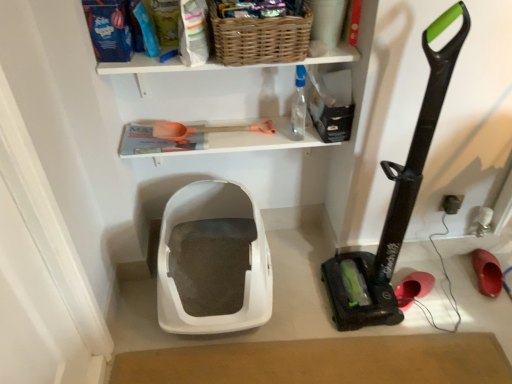
In order to click on vacant area that is situated to the right of black plastic vacuum cleaner at right in this screenshot , I will do `click(429, 296)`.